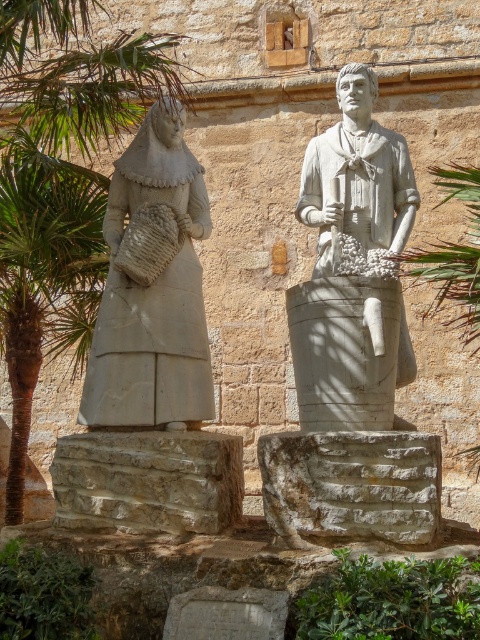
Does white marble statue at left have a greater width compared to white stone statue at center?

Correct, the width of white marble statue at left exceeds that of white stone statue at center.

Does white marble statue at left have a greater height compared to white stone statue at center?

No.

From the picture: Who is more forward, (x=117, y=365) or (x=347, y=88)?

Point (x=117, y=365) is more forward.

Locate an element on the screen. white marble statue at left is located at coordinates (153, 285).

Between point (12, 401) and point (336, 132), which one is positioned behind?

Positioned behind is point (12, 401).

Can you confirm if green leafy palm tree at left is positioned below white stone statue at center?

Yes.

Image resolution: width=480 pixels, height=640 pixels. What do you see at coordinates (45, 276) in the screenshot?
I see `green leafy palm tree at left` at bounding box center [45, 276].

Find the location of `green leafy palm tree at left`. green leafy palm tree at left is located at coordinates (45, 276).

Does white marble statue at left have a greater width compared to green leafy palm tree at left?

Incorrect, white marble statue at left's width does not surpass green leafy palm tree at left's.

Who is positioned more to the right, white marble statue at left or green leafy palm tree at left?

white marble statue at left

Find the location of `white marble statue at left`. white marble statue at left is located at coordinates (153, 285).